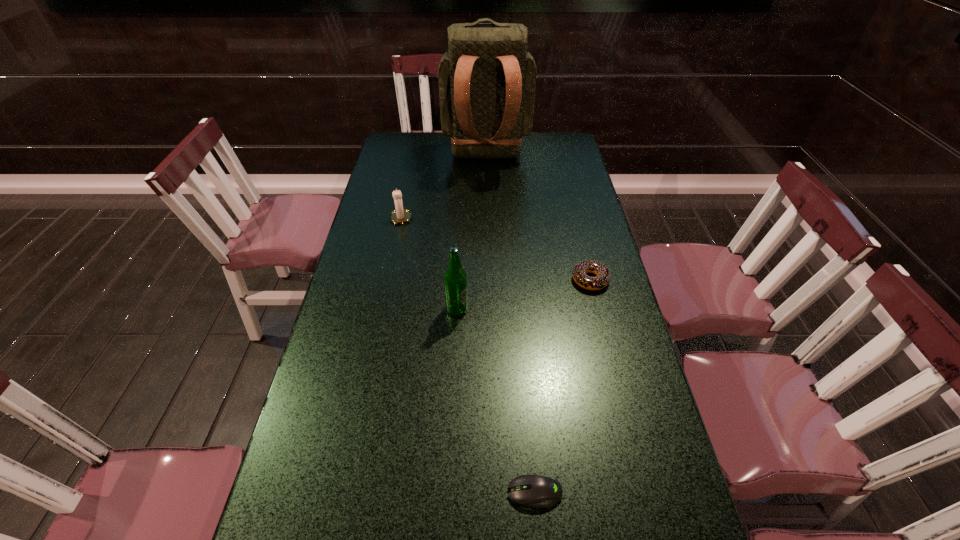
In order to click on free space between the computer mouse and the second nearest object in this screenshot , I will do `click(495, 401)`.

Find the location of `free space between the second nearest object and the tallest object`. free space between the second nearest object and the tallest object is located at coordinates (471, 233).

Image resolution: width=960 pixels, height=540 pixels. Find the location of `vacant space that is in between the doughnut and the fourth nearest object`. vacant space that is in between the doughnut and the fourth nearest object is located at coordinates (495, 248).

Locate an element on the screen. The width and height of the screenshot is (960, 540). free point between the backpack and the candle holder is located at coordinates point(444,187).

Find the location of `empty location between the doughnut and the backpack`. empty location between the doughnut and the backpack is located at coordinates (539, 219).

This screenshot has height=540, width=960. Find the location of `free area in between the fourth shortest object and the second farthest object`. free area in between the fourth shortest object and the second farthest object is located at coordinates (429, 263).

Locate an element on the screen. the third closest object to the rightmost object is located at coordinates (538, 491).

Where is `the closest object to the doughnut`? The width and height of the screenshot is (960, 540). the closest object to the doughnut is located at coordinates (455, 278).

The image size is (960, 540). I want to click on free spot that satisfies the following two spatial constraints: 1. on the back of the tallest object; 2. on the right side of the rightmost object, so click(x=489, y=280).

Find the location of `vacant space that satisfies the following two spatial constraints: 1. on the back of the backpack; 2. on the label of the second nearest object`. vacant space that satisfies the following two spatial constraints: 1. on the back of the backpack; 2. on the label of the second nearest object is located at coordinates (490, 309).